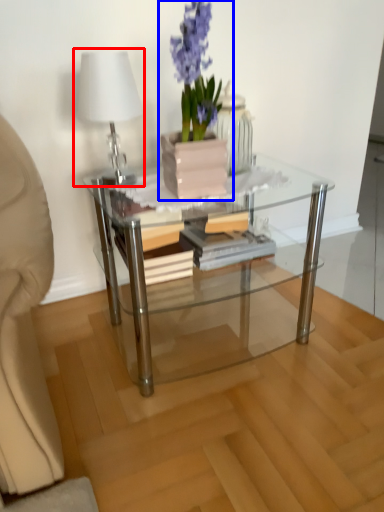
Question: Among these objects, which one is farthest to the camera, table lamp (highlighted by a red box) or houseplant (highlighted by a blue box)?

Choices:
 (A) table lamp
 (B) houseplant

Answer: (A)